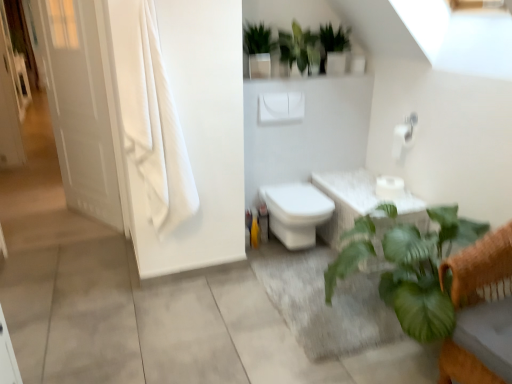
Locate an element on the screen. This screenshot has width=512, height=384. free space to the left of white glossy door at left is located at coordinates (48, 218).